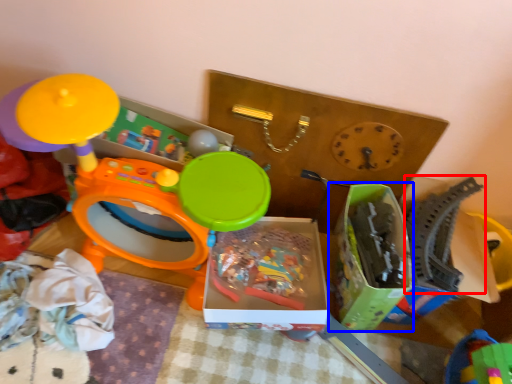
Question: Which of the following is the farthest to the observer, toy (highlighted by a red box) or storage box (highlighted by a blue box)?

Choices:
 (A) toy
 (B) storage box

Answer: (A)